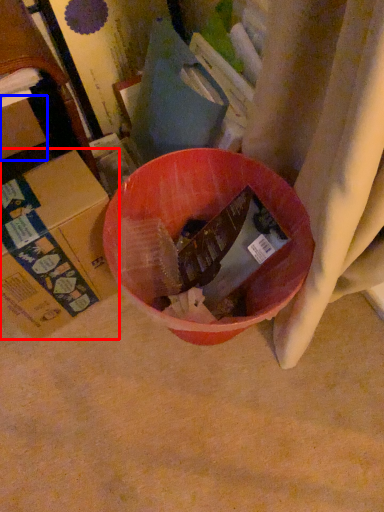
Question: Among these objects, which one is nearest to the camera, cardboard box (highlighted by a red box) or cardboard box (highlighted by a blue box)?

Choices:
 (A) cardboard box
 (B) cardboard box

Answer: (A)